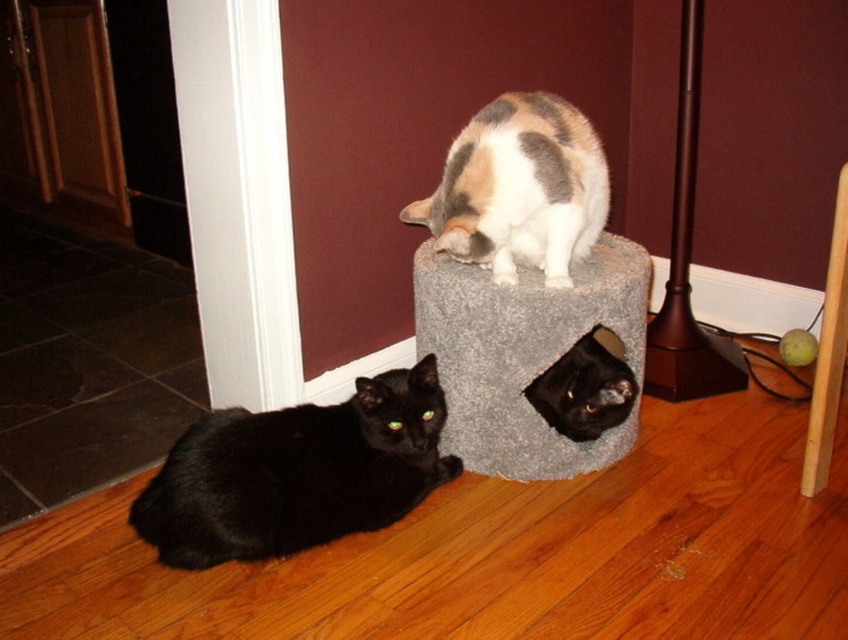
You are a photographer positioned at the center of the room. You want to take a picture of the black fur cat at lower left. According to the coordinates provided, where should you aim your camera to capture the cat in the frame?

You should aim your camera at the coordinates point (296, 472) to capture the black fur cat at lower left in the frame.

You are a cat owner who wants to place a new cat tree in the room. The cat tree is 30 cm tall. You see the black fur cat at lower left and the gray carpeted cat bed at center. Which object is shorter and can the cat tree fit next to it?

The black fur cat at lower left is shorter than the gray carpeted cat bed at center. Since the cat tree is 30 cm tall, it can fit next to the black fur cat at lower left as long as there is enough space.

You are a cat owner who wants to place a new toy between the black fur cat at lower left and the gray carpeted cat bed at center. Since you want the toy to be equally accessible to both cats, where should you place it?

The toy should be placed closer to the black fur cat at lower left since it is closer to the viewer than the gray carpeted cat bed at center, ensuring equal accessibility.